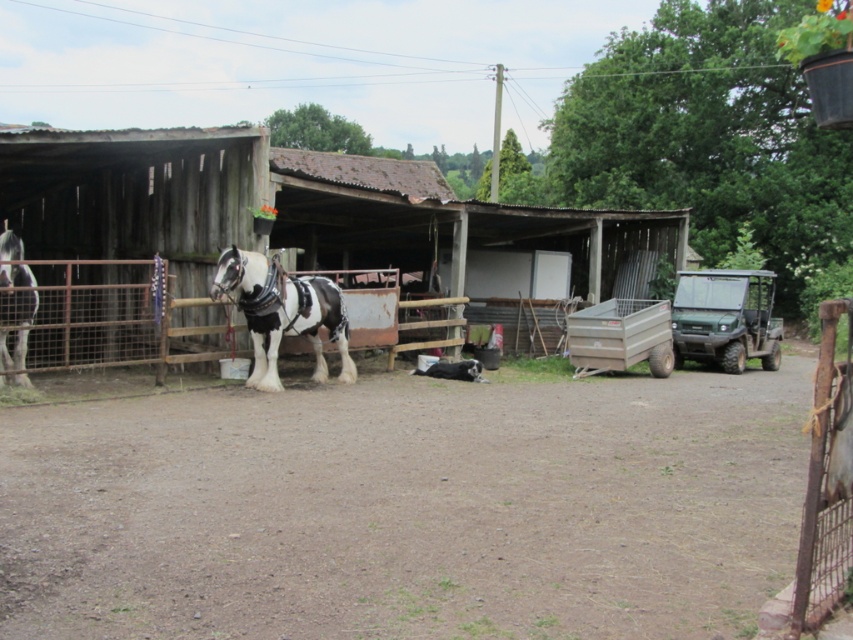
Question: Can you confirm if weathered wood barn at center is positioned above spotted glossy horse at left?

Choices:
 (A) no
 (B) yes

Answer: (B)

Question: Which object is closer to the camera taking this photo?

Choices:
 (A) spotted glossy horse at left
 (B) spotted glossy horse at center
 (C) weathered wood barn at center

Answer: (A)

Question: Estimate the real-world distances between objects in this image. Which object is closer to the spotted glossy horse at center?

Choices:
 (A) weathered wood barn at center
 (B) spotted glossy horse at left

Answer: (B)

Question: Does weathered wood barn at center have a smaller size compared to spotted glossy horse at left?

Choices:
 (A) no
 (B) yes

Answer: (A)

Question: Which of the following is the closest to the observer?

Choices:
 (A) weathered wood barn at center
 (B) spotted glossy horse at left

Answer: (B)

Question: Can you confirm if weathered wood barn at center is smaller than spotted glossy horse at center?

Choices:
 (A) yes
 (B) no

Answer: (B)